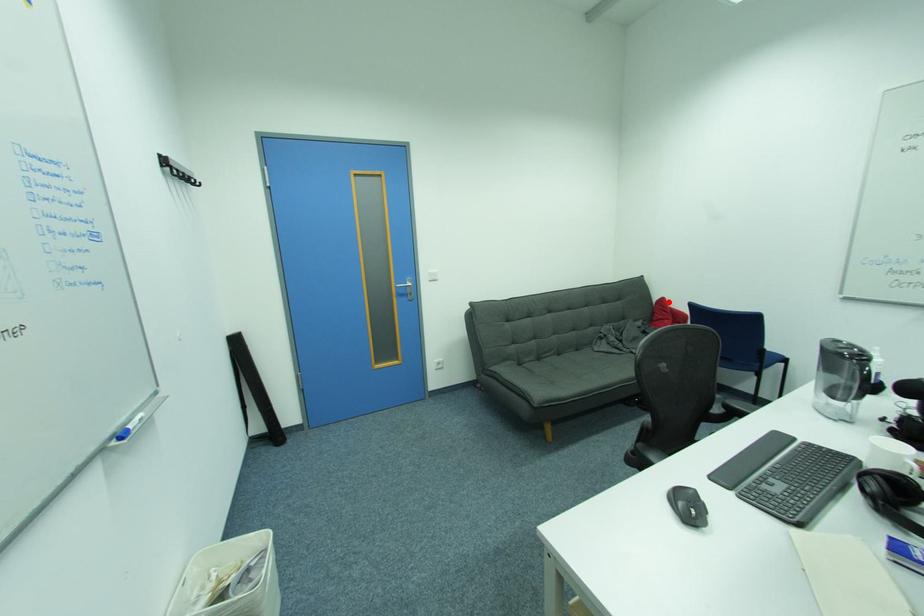
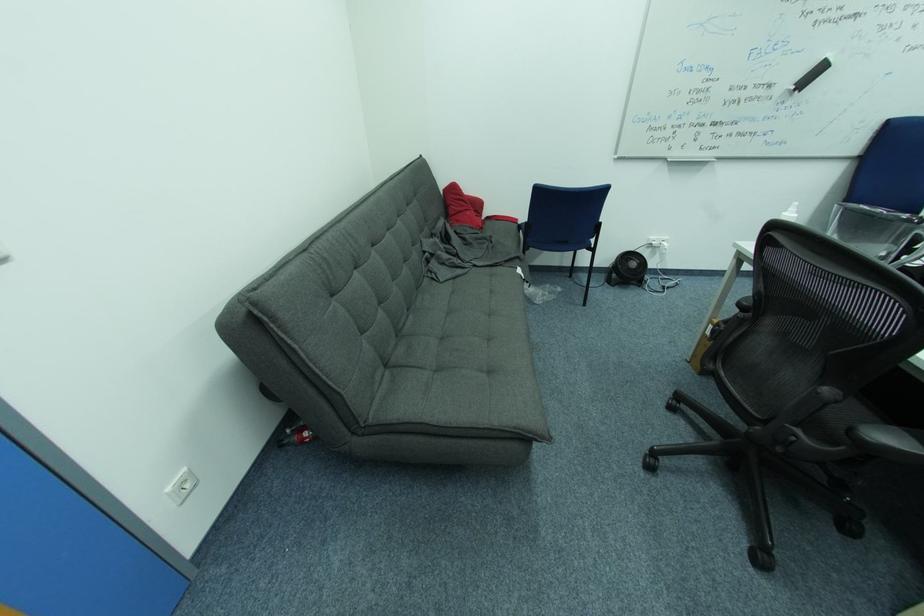
Question: A red point is marked in image1. In image2, is the corresponding 3D point closer to the camera or farther? Reply with the corresponding letter.

Choices:
 (A) The corresponding 3D point is closer.
 (B) The corresponding 3D point is farther.

Answer: (A)